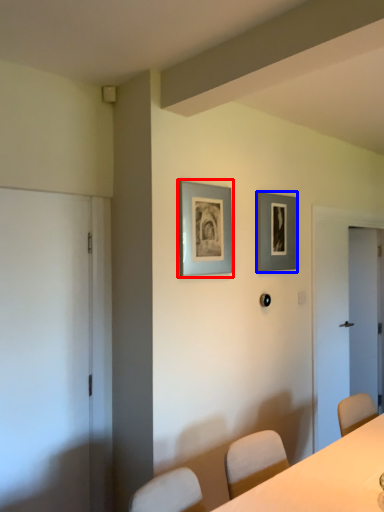
Question: Among these objects, which one is nearest to the camera, picture frame (highlighted by a red box) or picture frame (highlighted by a blue box)?

Choices:
 (A) picture frame
 (B) picture frame

Answer: (A)